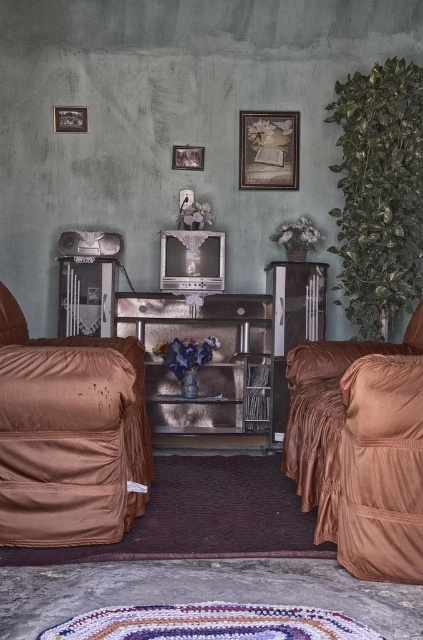
Question: Which point appears farthest from the camera in this image?

Choices:
 (A) (195, 148)
 (B) (359, 460)

Answer: (A)

Question: Does brown fabric armchair at left have a larger size compared to metallic cabinet at center?

Choices:
 (A) yes
 (B) no

Answer: (A)

Question: Where is suede-like brown daybed at right located in relation to wooden frame at upper center in the image?

Choices:
 (A) below
 (B) above

Answer: (A)

Question: Which object is farther from the camera taking this photo?

Choices:
 (A) suede-like brown daybed at right
 (B) wooden frame at upper center
 (C) wooden picture frame at upper center
 (D) wooden picture frame at upper left

Answer: (C)

Question: Among these points, which one is farthest from the camera?

Choices:
 (A) (74, 349)
 (B) (310, 406)
 (C) (71, 115)
 (D) (150, 301)

Answer: (C)

Question: Is suede-like brown daybed at right bigger than metallic cabinet at center?

Choices:
 (A) no
 (B) yes

Answer: (B)